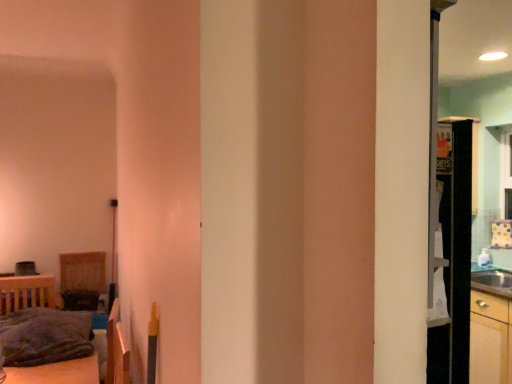
What do you see at coordinates (57, 372) in the screenshot? The width and height of the screenshot is (512, 384). I see `dark gray fabric bed at lower left` at bounding box center [57, 372].

The image size is (512, 384). Find the location of `dark gray fabric bed at lower left`. dark gray fabric bed at lower left is located at coordinates (57, 372).

Identify the location of dark gray fabric bed at lower left. (57, 372).